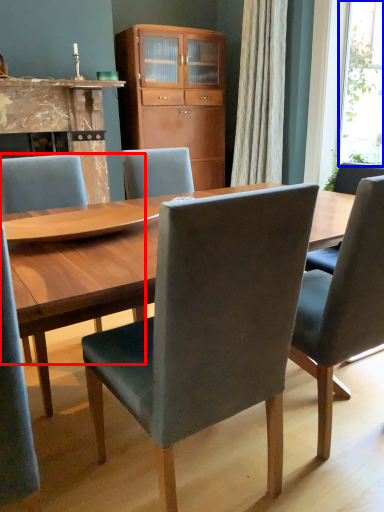
Question: Which of the following is the closest to the observer, chair (highlighted by a red box) or window screen (highlighted by a blue box)?

Choices:
 (A) chair
 (B) window screen

Answer: (A)